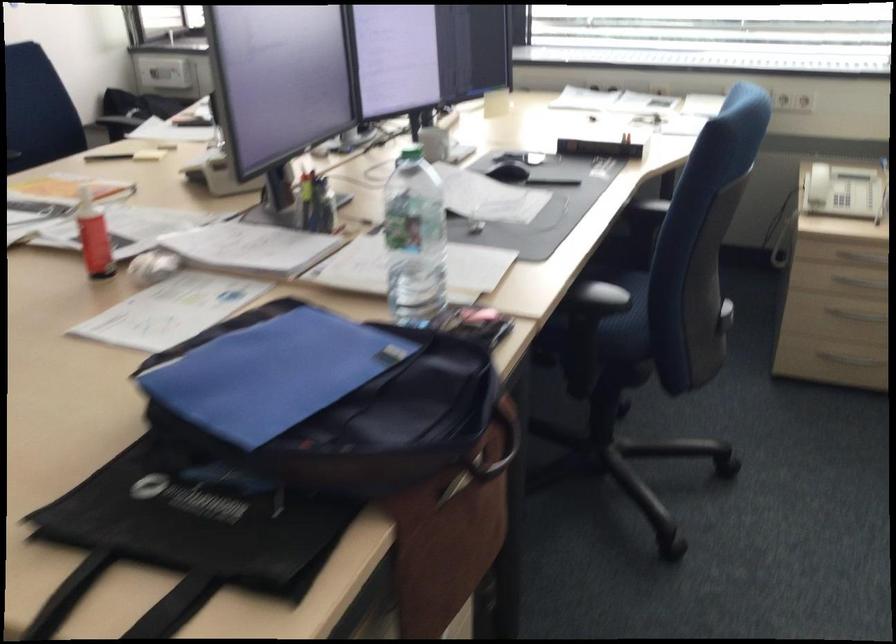
What do you see at coordinates (624, 317) in the screenshot? I see `a chair sitting surface` at bounding box center [624, 317].